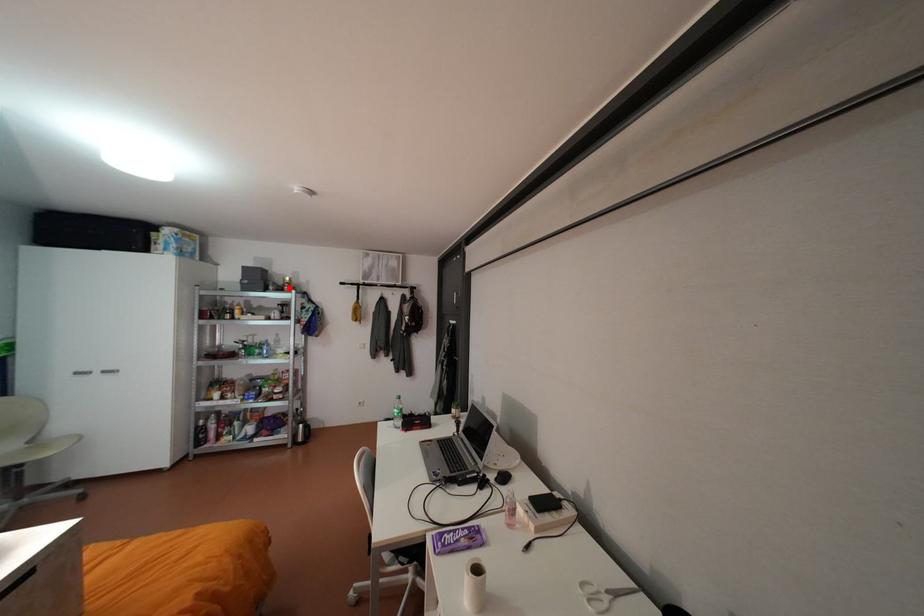
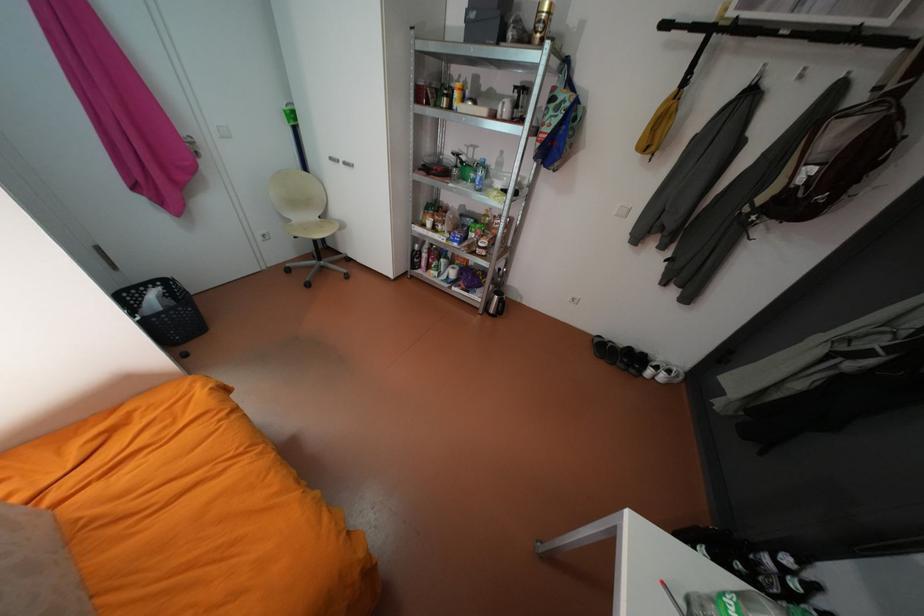
Find the pixel in the second image that matches the highlighted location in the first image.

(533, 39)